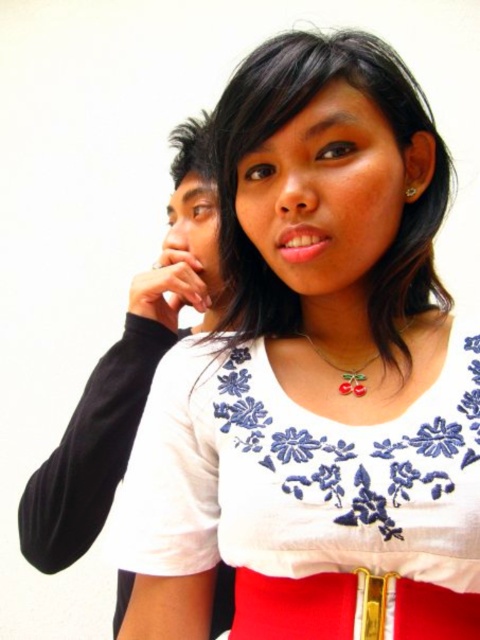
Question: Which of the following is the farthest from the observer?

Choices:
 (A) (131, 285)
 (B) (359, 604)
 (C) (477, 333)
 (D) (173, 209)

Answer: (A)

Question: Among these points, which one is farthest from the camera?

Choices:
 (A) click(x=345, y=452)
 (B) click(x=124, y=579)

Answer: (B)

Question: Which object is positioned farthest from the white embroidered dress at center?

Choices:
 (A) black matte shirt at left
 (B) red leather belt at center
 (C) matte black hand at upper left

Answer: (C)

Question: Where is white embroidered dress at center located in relation to black matte shirt at left in the image?

Choices:
 (A) left
 (B) right

Answer: (B)

Question: Is white embroidered dress at center further to the viewer compared to black matte shirt at left?

Choices:
 (A) no
 (B) yes

Answer: (A)

Question: Can you confirm if black matte shirt at left is positioned to the right of red leather belt at center?

Choices:
 (A) no
 (B) yes

Answer: (A)